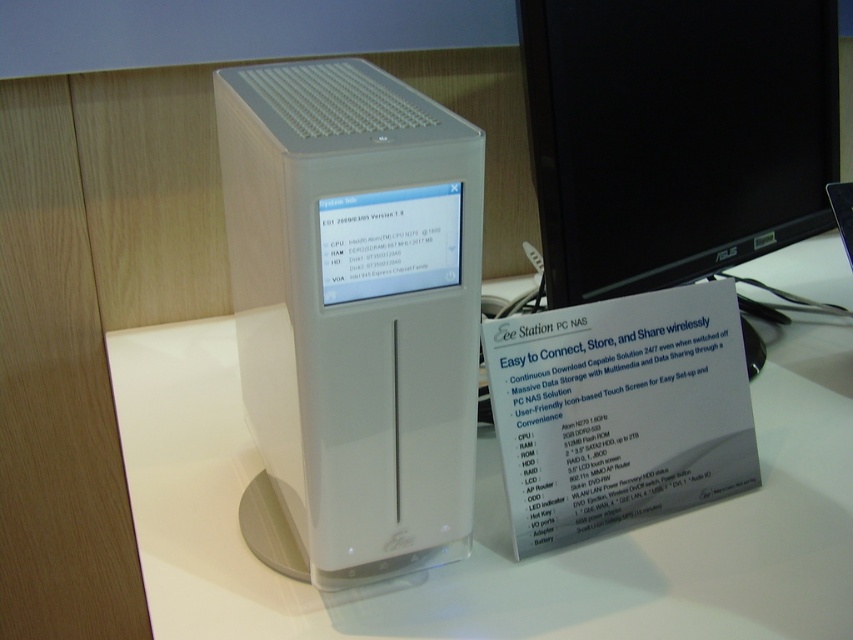
You are setting up a home office and need to place both the white plastic computer desk at center and the white plastic computer tower at center. According to the image, which object should be placed on the left side to ensure proper positioning?

The white plastic computer tower at center should be placed on the left side because the white plastic computer desk at center is to the right of it.

You are setting up a home office and have both the white plastic computer desk at center and the black glossy monitor at upper right. Which object would you place your laptop on to ensure it has enough space?

The white plastic computer desk at center has a larger size compared to the black glossy monitor at upper right, so placing your laptop on the white plastic computer desk at center would provide sufficient space.